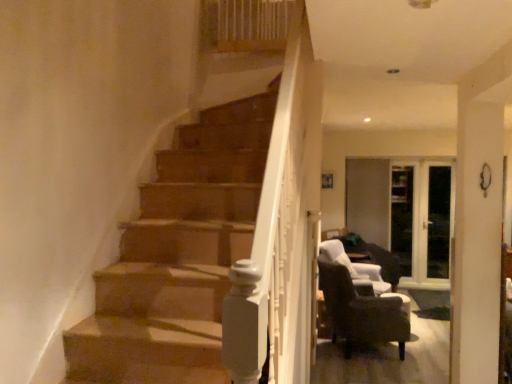
Question: From a real-world perspective, is dark brown leather armchair at lower right, the 1th chair in the front-to-back sequence, physically located above or below dark brown leather chair at lower right, placed as the first chair when sorted from back to front?

Choices:
 (A) above
 (B) below

Answer: (A)

Question: Relative to dark brown leather chair at lower right, placed as the first chair when sorted from back to front, is dark brown leather armchair at lower right, the 1th chair in the front-to-back sequence, in front or behind?

Choices:
 (A) behind
 (B) front

Answer: (B)

Question: Which of these objects is positioned farthest from the transparent glass door at center, which is counted as the 1th glass door, starting from the left?

Choices:
 (A) dark brown leather armchair at lower right, arranged as the second chair when viewed from the back
 (B) transparent glass door at right, which is the first glass door in right-to-left order
 (C) dark brown leather chair at lower right, placed as the first chair when sorted from back to front

Answer: (A)

Question: Which is farther from the transparent glass door at center, which is counted as the 1th glass door, starting from the left?

Choices:
 (A) transparent glass door at right, which is the first glass door in right-to-left order
 (B) dark brown leather armchair at lower right, the 1th chair in the front-to-back sequence
 (C) dark brown leather chair at lower right, placed as the first chair when sorted from back to front

Answer: (B)